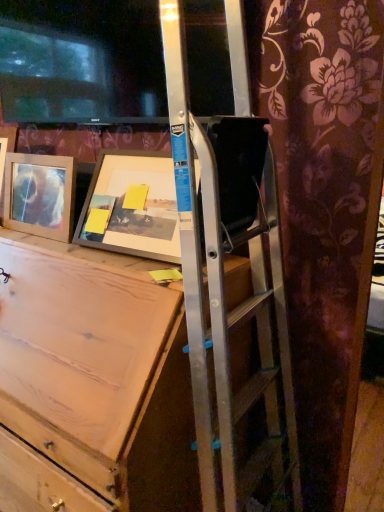
Where is `wooden picture frame at left`? The height and width of the screenshot is (512, 384). wooden picture frame at left is located at coordinates (40, 195).

What do you see at coordinates (40, 195) in the screenshot? I see `wooden picture frame at left` at bounding box center [40, 195].

Locate an element on the screen. This screenshot has width=384, height=512. wooden picture frame at left is located at coordinates (40, 195).